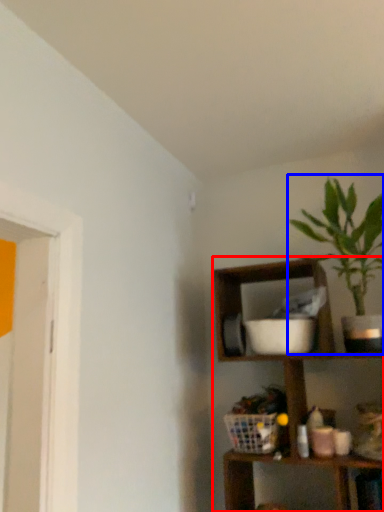
Question: Among these objects, which one is farthest to the camera, shelf (highlighted by a red box) or houseplant (highlighted by a blue box)?

Choices:
 (A) shelf
 (B) houseplant

Answer: (B)